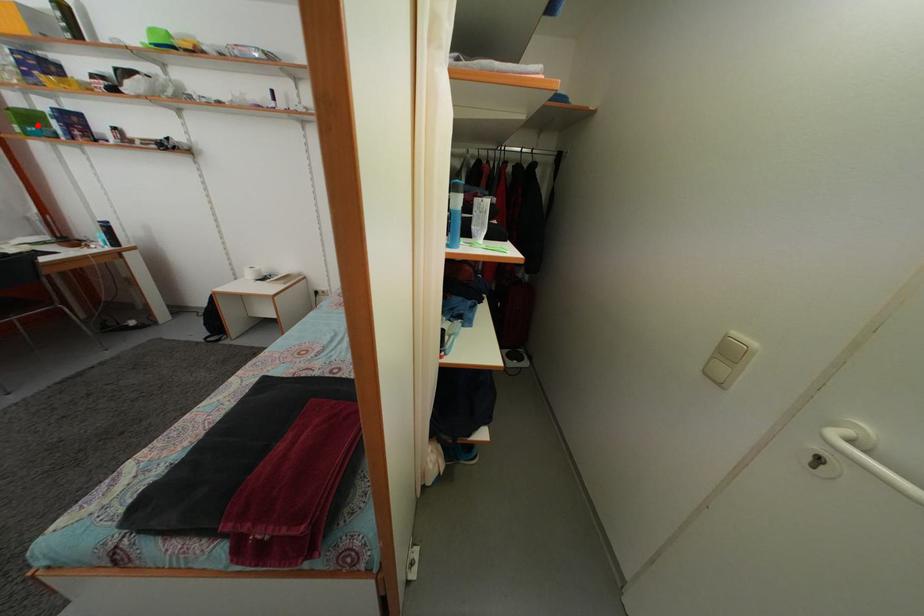
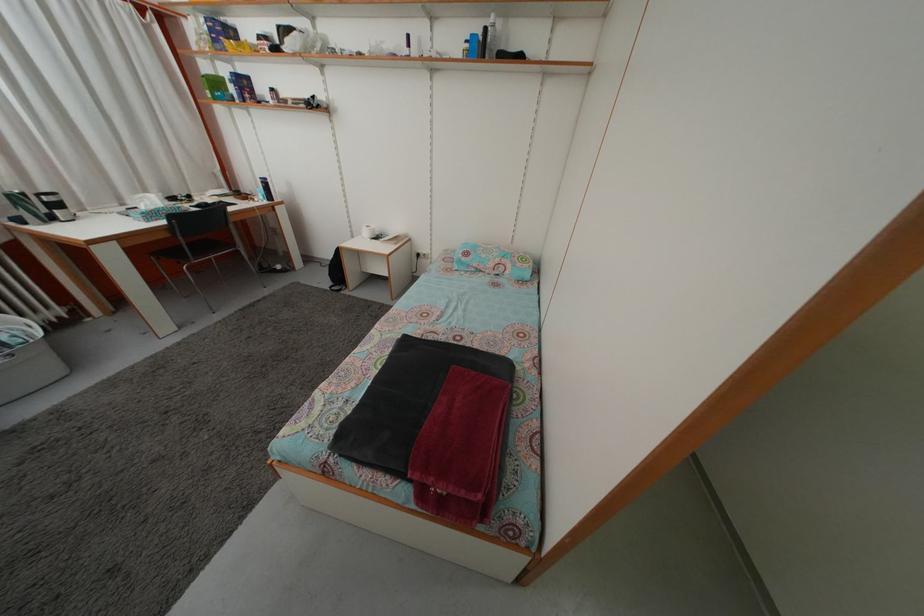
Question: I am providing you with two images of the same scene from different viewpoints. Given a red point in image1, look at the same physical point in image2. Is it:

Choices:
 (A) Closer to the viewpoint
 (B) Farther from the viewpoint

Answer: (A)